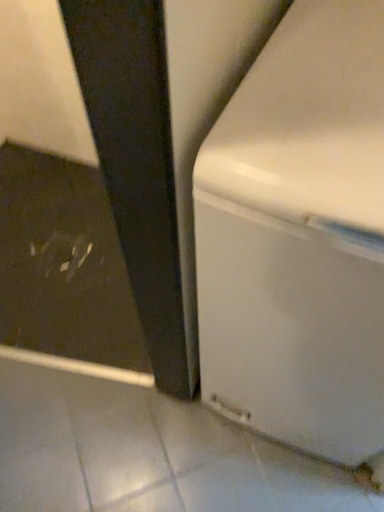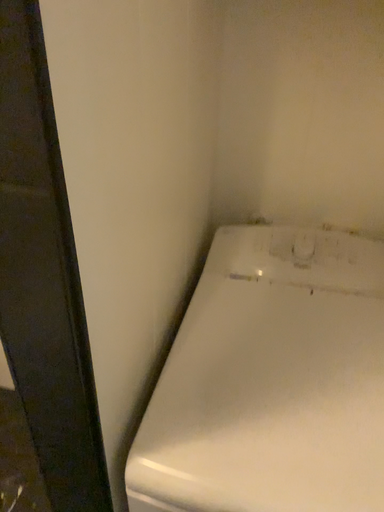
Question: How did the camera likely rotate when shooting the video?

Choices:
 (A) rotated right
 (B) rotated left

Answer: (A)